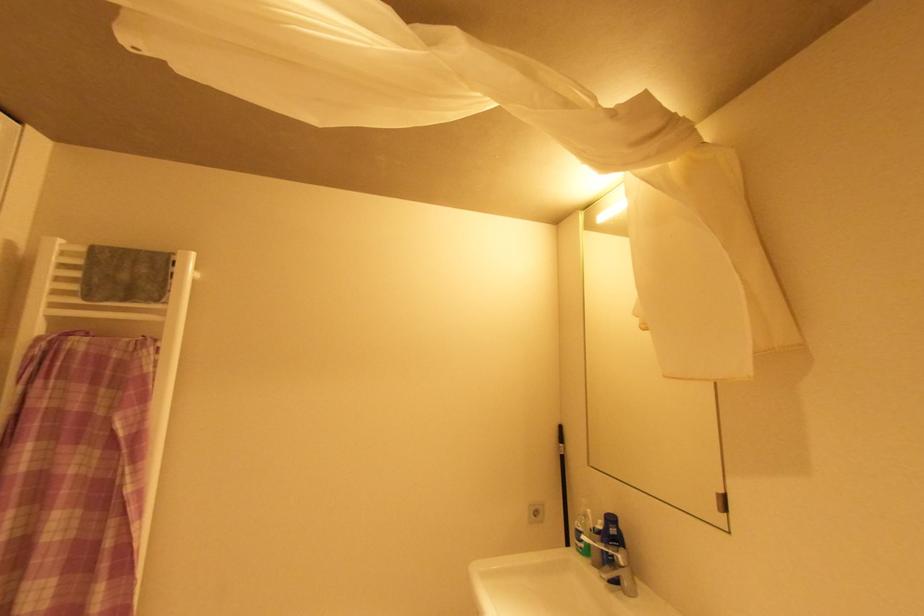
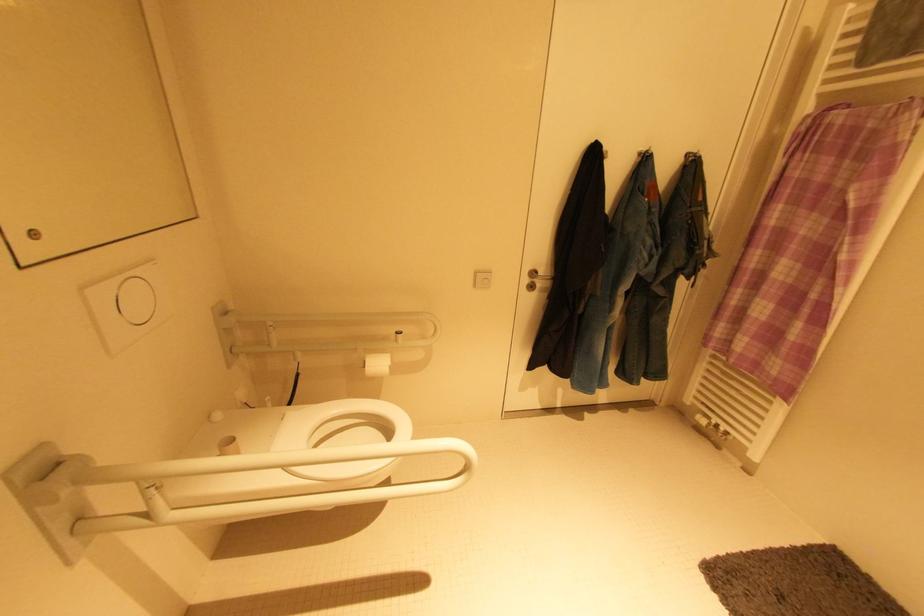
First-person continuous shooting, in which direction is the camera rotating?

The rotation direction of the camera is left-down.